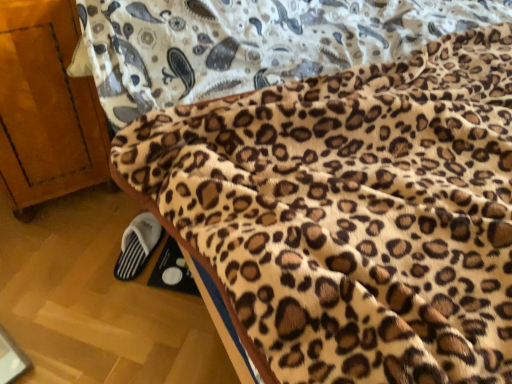
Question: From the image's perspective, is white fabric slipper at lower left on top of leopard print fleece blanket at lower right?

Choices:
 (A) yes
 (B) no

Answer: (B)

Question: Is white fabric slipper at lower left thinner than leopard print fleece blanket at lower right?

Choices:
 (A) yes
 (B) no

Answer: (A)

Question: Is white fabric slipper at lower left at the right side of leopard print fleece blanket at lower right?

Choices:
 (A) yes
 (B) no

Answer: (B)

Question: From a real-world perspective, is white fabric slipper at lower left on leopard print fleece blanket at lower right?

Choices:
 (A) yes
 (B) no

Answer: (A)

Question: Is white fabric slipper at lower left bigger than leopard print fleece blanket at lower right?

Choices:
 (A) no
 (B) yes

Answer: (A)

Question: Is white fabric slipper at lower left to the left of leopard print fleece blanket at lower right from the viewer's perspective?

Choices:
 (A) no
 (B) yes

Answer: (B)

Question: Considering the relative sizes of wooden cabinet at left and white fabric slipper at lower left in the image provided, is wooden cabinet at left wider than white fabric slipper at lower left?

Choices:
 (A) no
 (B) yes

Answer: (B)

Question: Is wooden cabinet at left positioned beyond the bounds of white fabric slipper at lower left?

Choices:
 (A) no
 (B) yes

Answer: (B)

Question: Is wooden cabinet at left placed right next to white fabric slipper at lower left?

Choices:
 (A) no
 (B) yes

Answer: (A)

Question: Can you confirm if wooden cabinet at left is smaller than white fabric slipper at lower left?

Choices:
 (A) yes
 (B) no

Answer: (B)

Question: Considering the relative positions of wooden cabinet at left and white fabric slipper at lower left in the image provided, is wooden cabinet at left to the left of white fabric slipper at lower left from the viewer's perspective?

Choices:
 (A) no
 (B) yes

Answer: (B)

Question: Is wooden cabinet at left in front of white fabric slipper at lower left?

Choices:
 (A) yes
 (B) no

Answer: (A)

Question: From the image's perspective, is leopard print fleece blanket at lower right over white fabric slipper at lower left?

Choices:
 (A) no
 (B) yes

Answer: (B)